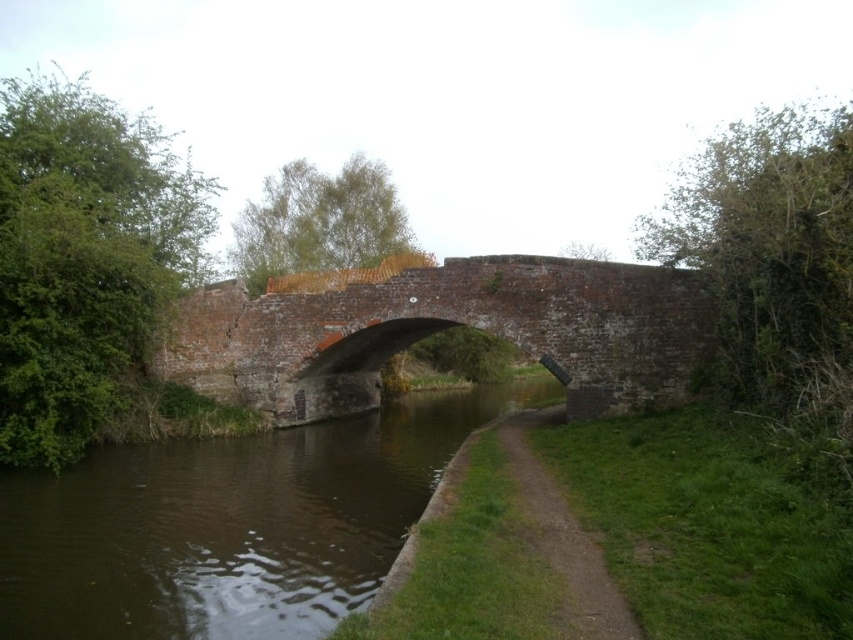
Question: Does brown smooth water at center have a lesser width compared to dirt/gravel path at center?

Choices:
 (A) no
 (B) yes

Answer: (A)

Question: Is brown smooth water at center in front of dirt/gravel path at center?

Choices:
 (A) no
 (B) yes

Answer: (A)

Question: Is brown brick bridge at center in front of dirt/gravel path at center?

Choices:
 (A) yes
 (B) no

Answer: (B)

Question: Which object is farther from the camera taking this photo?

Choices:
 (A) dirt/gravel path at center
 (B) brown brick bridge at center

Answer: (B)

Question: Estimate the real-world distances between objects in this image. Which object is farther from the brown brick bridge at center?

Choices:
 (A) dirt/gravel path at center
 (B) brown smooth water at center

Answer: (A)

Question: Which point is farther to the camera?

Choices:
 (A) (321, 486)
 (B) (614, 605)

Answer: (A)